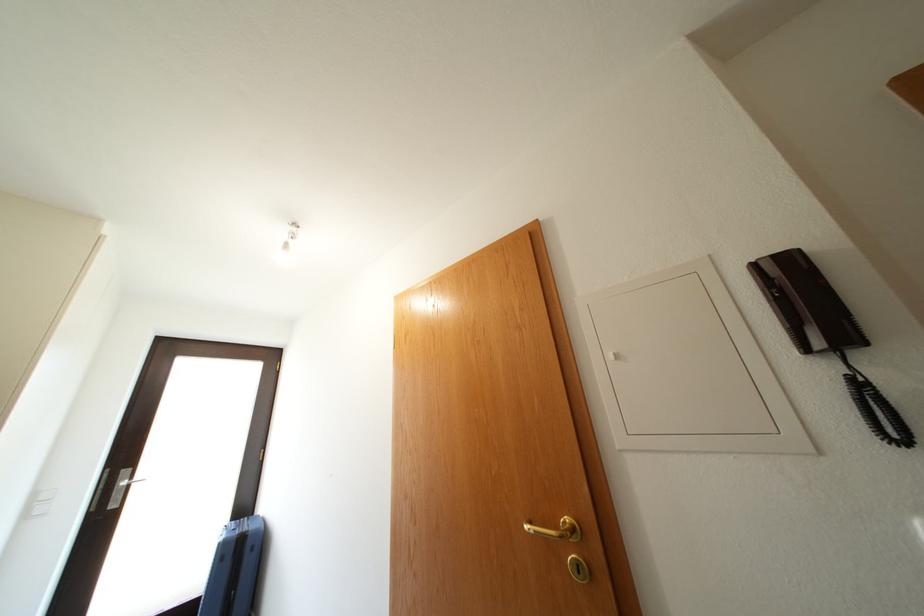
Where is `gold door handle`? This screenshot has height=616, width=924. gold door handle is located at coordinates (555, 530).